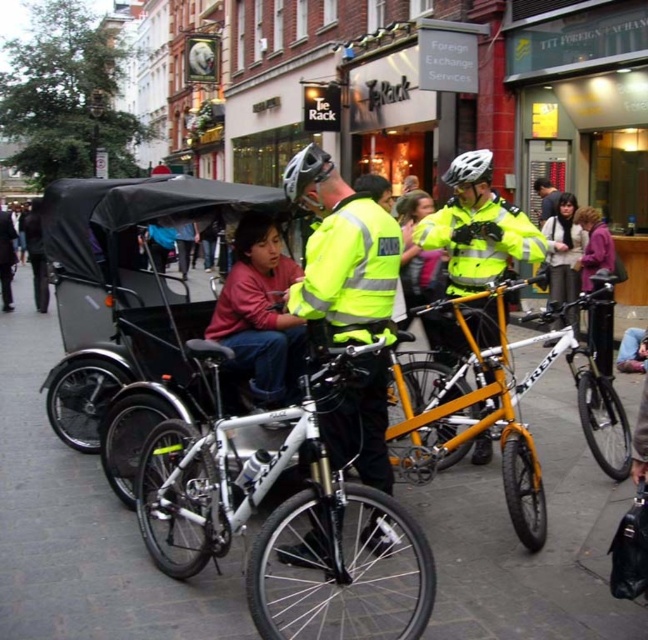
Question: Can you confirm if white matte pavement at center is wider than orange metallic bicycle at center?

Choices:
 (A) yes
 (B) no

Answer: (B)

Question: Does black fabric rickshaw at center have a smaller size compared to matte black helmet at center?

Choices:
 (A) no
 (B) yes

Answer: (B)

Question: Which object appears farthest from the camera in this image?

Choices:
 (A) white matte trek mountain bike at center
 (B) high-visibility reflective jacket at center

Answer: (B)

Question: Among these objects, which one is nearest to the camera?

Choices:
 (A) white matte trek mountain bike at center
 (B) orange metallic bicycle at center
 (C) white matte bicycle helmet at center
 (D) white matte pavement at center

Answer: (A)

Question: Estimate the real-world distances between objects in this image. Which object is closer to the black fabric rickshaw at center?

Choices:
 (A) orange metallic bicycle at center
 (B) dark brown leather jacket at center

Answer: (A)

Question: Is the position of black fabric rickshaw at center more distant than that of high-visibility reflective jacket at center?

Choices:
 (A) no
 (B) yes

Answer: (B)